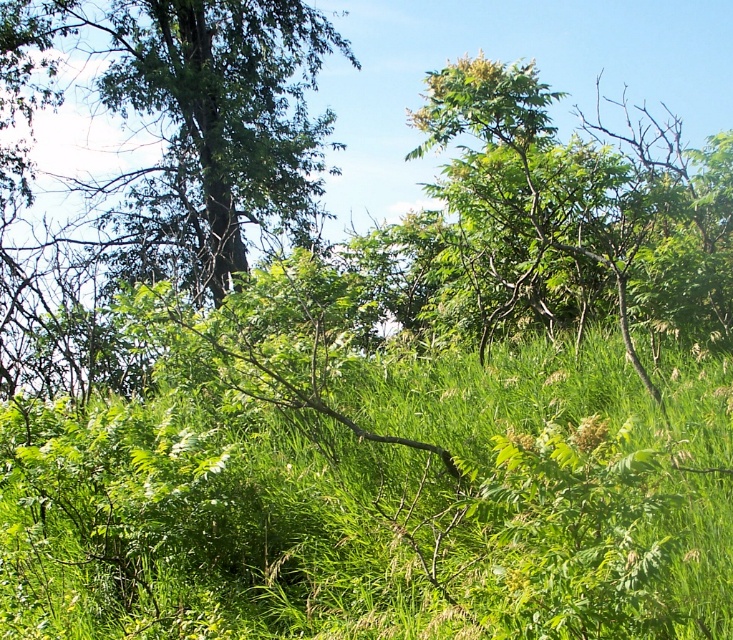
Question: Does green leafy grass at center appear on the right side of green leafy tree at upper left?

Choices:
 (A) no
 (B) yes

Answer: (B)

Question: Which object is farther from the camera taking this photo?

Choices:
 (A) green leafy tree at upper left
 (B) green leafy grass at center

Answer: (A)

Question: Among these objects, which one is nearest to the camera?

Choices:
 (A) green leafy grass at center
 (B) green leafy tree at upper left

Answer: (A)

Question: Can you confirm if green leafy grass at center is thinner than green leafy tree at upper left?

Choices:
 (A) yes
 (B) no

Answer: (B)

Question: Is green leafy grass at center above green leafy tree at upper left?

Choices:
 (A) no
 (B) yes

Answer: (A)